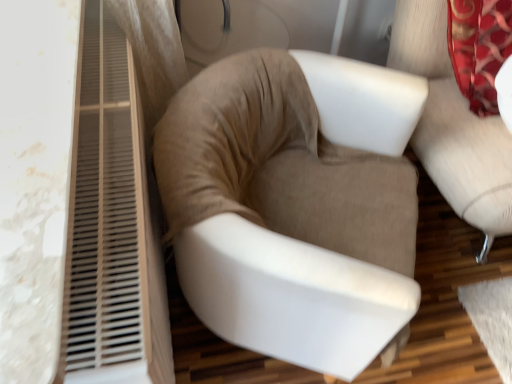
Image resolution: width=512 pixels, height=384 pixels. Describe the element at coordinates (454, 125) in the screenshot. I see `suede beige armchair at center, the 1th chair positioned from the right` at that location.

The image size is (512, 384). I want to click on suede beige armchair at center, marked as the 2th chair in a left-to-right arrangement, so click(x=454, y=125).

Measure the distance between suede beige armchair at center, marked as the 2th chair in a left-to-right arrangement, and camera.

They are 1.17 meters apart.

Where is `suede-like beige chair at center, the first chair positioned from the left`? The image size is (512, 384). suede-like beige chair at center, the first chair positioned from the left is located at coordinates (293, 206).

Image resolution: width=512 pixels, height=384 pixels. What do you see at coordinates (293, 206) in the screenshot?
I see `suede-like beige chair at center, the first chair positioned from the left` at bounding box center [293, 206].

You are a GUI agent. You are given a task and a screenshot of the screen. Output one action in this format:
    pyautogui.click(x=<x>, y=<y>)
    Task: Click on the suede beige armchair at center, marked as the 2th chair in a left-to-right arrangement
    The height and width of the screenshot is (384, 512).
    Given the screenshot: What is the action you would take?
    pyautogui.click(x=454, y=125)

Which is more to the right, suede beige armchair at center, the 1th chair positioned from the right, or suede-like beige chair at center, the second chair when ordered from right to left?

Positioned to the right is suede beige armchair at center, the 1th chair positioned from the right.

Does suede beige armchair at center, marked as the 2th chair in a left-to-right arrangement, lie in front of suede-like beige chair at center, the first chair positioned from the left?

No, it is behind suede-like beige chair at center, the first chair positioned from the left.

Does point (476, 146) appear closer or farther from the camera than point (172, 152)?

Clearly, point (476, 146) is more distant from the camera than point (172, 152).

From the image's perspective, which one is positioned lower, suede beige armchair at center, the 1th chair positioned from the right, or suede-like beige chair at center, the first chair positioned from the left?

suede-like beige chair at center, the first chair positioned from the left, from the image's perspective.

From a real-world perspective, is suede beige armchair at center, marked as the 2th chair in a left-to-right arrangement, positioned over suede-like beige chair at center, the first chair positioned from the left, based on gravity?

Yes, from a real-world perspective, suede beige armchair at center, marked as the 2th chair in a left-to-right arrangement, is over suede-like beige chair at center, the first chair positioned from the left

Does suede beige armchair at center, the 1th chair positioned from the right, have a lesser width compared to suede-like beige chair at center, the first chair positioned from the left?

Incorrect, the width of suede beige armchair at center, the 1th chair positioned from the right, is not less than that of suede-like beige chair at center, the first chair positioned from the left.

Can you confirm if suede beige armchair at center, marked as the 2th chair in a left-to-right arrangement, is shorter than suede-like beige chair at center, the first chair positioned from the left?

No.

Which of these two, suede beige armchair at center, marked as the 2th chair in a left-to-right arrangement, or suede-like beige chair at center, the second chair when ordered from right to left, is bigger?

Bigger between the two is suede beige armchair at center, marked as the 2th chair in a left-to-right arrangement.

Is suede-like beige chair at center, the first chair positioned from the left, located within suede beige armchair at center, marked as the 2th chair in a left-to-right arrangement?

Definitely not — suede-like beige chair at center, the first chair positioned from the left, is not inside suede beige armchair at center, marked as the 2th chair in a left-to-right arrangement.

Does suede beige armchair at center, marked as the 2th chair in a left-to-right arrangement, touch suede-like beige chair at center, the second chair when ordered from right to left?

suede beige armchair at center, marked as the 2th chair in a left-to-right arrangement, and suede-like beige chair at center, the second chair when ordered from right to left, are not in contact.

Does suede beige armchair at center, marked as the 2th chair in a left-to-right arrangement, turn towards suede-like beige chair at center, the second chair when ordered from right to left?

No.

What's the angular difference between suede beige armchair at center, the 1th chair positioned from the right, and suede-like beige chair at center, the second chair when ordered from right to left,'s facing directions?

The angle between the facing direction of suede beige armchair at center, the 1th chair positioned from the right, and the facing direction of suede-like beige chair at center, the second chair when ordered from right to left, is 62.3 degrees.

The width and height of the screenshot is (512, 384). What are the coordinates of `chair below the suede beige armchair at center, the 1th chair positioned from the right (from a real-world perspective)` in the screenshot? It's located at (293, 206).

Considering the relative positions of suede-like beige chair at center, the first chair positioned from the left, and suede beige armchair at center, the 1th chair positioned from the right, in the image provided, is suede-like beige chair at center, the first chair positioned from the left, to the left of suede beige armchair at center, the 1th chair positioned from the right, from the viewer's perspective?

Yes, suede-like beige chair at center, the first chair positioned from the left, is to the left of suede beige armchair at center, the 1th chair positioned from the right.

Is suede-like beige chair at center, the second chair when ordered from right to left, in front of or behind suede beige armchair at center, the 1th chair positioned from the right, in the image?

In the image, suede-like beige chair at center, the second chair when ordered from right to left, appears in front of suede beige armchair at center, the 1th chair positioned from the right.

Considering the positions of point (343, 347) and point (494, 206), is point (343, 347) closer or farther from the camera than point (494, 206)?

Point (343, 347) appears to be closer to the viewer than point (494, 206).

From the image's perspective, is suede-like beige chair at center, the second chair when ordered from right to left, beneath suede beige armchair at center, the 1th chair positioned from the right?

Yes, from the image's perspective, suede-like beige chair at center, the second chair when ordered from right to left, is below suede beige armchair at center, the 1th chair positioned from the right.

From a real-world perspective, which is physically below, suede-like beige chair at center, the first chair positioned from the left, or suede beige armchair at center, marked as the 2th chair in a left-to-right arrangement?

In real-world perspective, suede-like beige chair at center, the first chair positioned from the left, is lower.

Is suede-like beige chair at center, the first chair positioned from the left, thinner than suede beige armchair at center, the 1th chair positioned from the right?

Yes, suede-like beige chair at center, the first chair positioned from the left, is thinner than suede beige armchair at center, the 1th chair positioned from the right.

Considering the sizes of suede-like beige chair at center, the first chair positioned from the left, and suede beige armchair at center, marked as the 2th chair in a left-to-right arrangement, in the image, is suede-like beige chair at center, the first chair positioned from the left, taller or shorter than suede beige armchair at center, marked as the 2th chair in a left-to-right arrangement,?

suede-like beige chair at center, the first chair positioned from the left, is shorter than suede beige armchair at center, marked as the 2th chair in a left-to-right arrangement.

Who is smaller, suede-like beige chair at center, the second chair when ordered from right to left, or suede beige armchair at center, the 1th chair positioned from the right?

With smaller size is suede-like beige chair at center, the second chair when ordered from right to left.

Can suede beige armchair at center, marked as the 2th chair in a left-to-right arrangement, be found inside suede-like beige chair at center, the second chair when ordered from right to left?

No, suede beige armchair at center, marked as the 2th chair in a left-to-right arrangement, is not surrounded by suede-like beige chair at center, the second chair when ordered from right to left.

Is there a large distance between suede-like beige chair at center, the first chair positioned from the left, and suede beige armchair at center, the 1th chair positioned from the right?

They are positioned close to each other.

Is suede-like beige chair at center, the first chair positioned from the left, facing towards suede beige armchair at center, the 1th chair positioned from the right?

No, suede-like beige chair at center, the first chair positioned from the left, is not facing towards suede beige armchair at center, the 1th chair positioned from the right.

Looking at this image, how different are the orientations of suede-like beige chair at center, the first chair positioned from the left, and suede beige armchair at center, the 1th chair positioned from the right, in degrees?

The facing directions of suede-like beige chair at center, the first chair positioned from the left, and suede beige armchair at center, the 1th chair positioned from the right, are 62.3 degrees apart.

How far apart are suede-like beige chair at center, the first chair positioned from the left, and suede beige armchair at center, marked as the 2th chair in a left-to-right arrangement?

The distance of suede-like beige chair at center, the first chair positioned from the left, from suede beige armchair at center, marked as the 2th chair in a left-to-right arrangement, is 18.43 inches.

This screenshot has height=384, width=512. I want to click on chair that appears above the suede-like beige chair at center, the first chair positioned from the left (from the image's perspective), so click(454, 125).

You are a GUI agent. You are given a task and a screenshot of the screen. Output one action in this format:
    pyautogui.click(x=<x>, y=<y>)
    Task: Click on the chair to the right of suede-like beige chair at center, the first chair positioned from the left
    This screenshot has width=512, height=384.
    Given the screenshot: What is the action you would take?
    [x=454, y=125]

Locate an element on the screen. chair that appears in front of the suede beige armchair at center, the 1th chair positioned from the right is located at coordinates (293, 206).